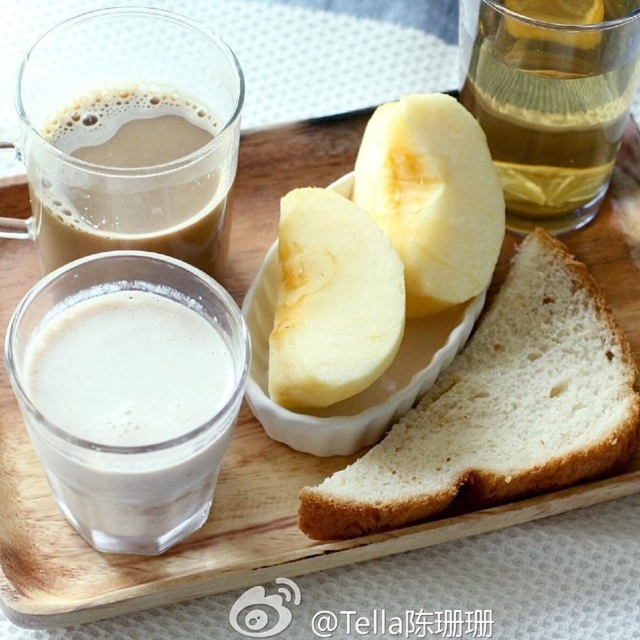
You are a breakfast delivery robot with a 15 cm wide opening. You need to pick up the white soft bread at center and the white frothy coffee at lower left from the tray. Can both items fit through the opening at the same time?

The white soft bread at center is larger in size than the white frothy coffee at lower left. Since the robot has a 15 cm wide opening, it depends on the combined width of both items. However, since the bread is larger, if its width alone exceeds 15 cm, they cannot fit together. The description does not provide exact measurements, so we cannot confirm.

You are planning to place a small toy that requires 150 cm2 of space on the wooden tray. Considering the items on the tray, which one between the yellow smooth apple at center and the yellow matte banana at center would you remove to free up more space?

The yellow smooth apple at center occupies less space than the yellow matte banana at center, so removing the yellow matte banana at center would free up more space.

You are preparing to serve a fruit platter and need to arrange the yellow smooth apple at center and the yellow matte banana at center on a shelf. The shelf has limited height clearance. Which fruit should you place first to ensure it fits under the shelf?

The yellow smooth apple at center is not as tall as the yellow matte banana at center, so you should place the yellow matte banana at center first to ensure it fits under the shelf.